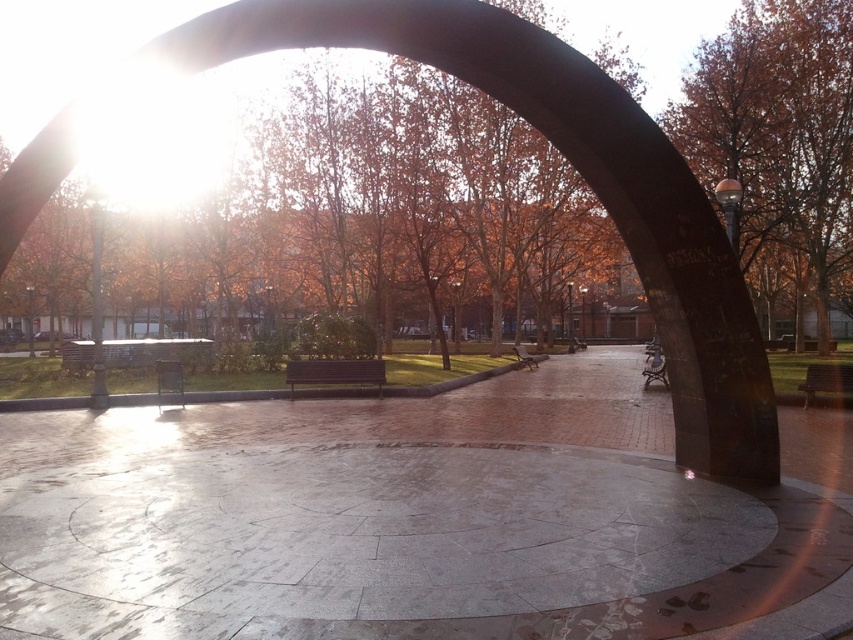
Does polished bronze arch at center have a lesser width compared to brown wood tree at right?

Correct, polished bronze arch at center's width is less than brown wood tree at right's.

Between point (9, 250) and point (773, 173), which one is positioned in front?

Positioned in front is point (9, 250).

The image size is (853, 640). I want to click on polished bronze arch at center, so click(445, 68).